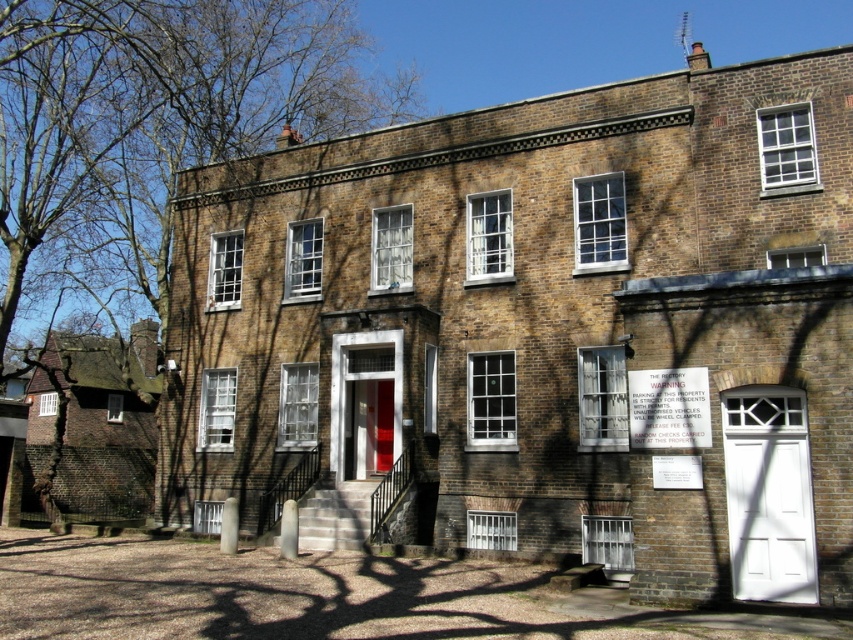
Which of these two, bare branches at left or white matte door at lower right, stands taller?

bare branches at left is taller.

Does point (347, 36) lie in front of point (801, 445)?

No, it is not.

Where is `bare branches at left`? The height and width of the screenshot is (640, 853). bare branches at left is located at coordinates (158, 125).

You are a GUI agent. You are given a task and a screenshot of the screen. Output one action in this format:
    pyautogui.click(x=<x>, y=<y>)
    Task: Click on the bare branches at left
    This screenshot has height=640, width=853.
    Given the screenshot: What is the action you would take?
    pyautogui.click(x=158, y=125)

Locate an element on the screen. bare branches at left is located at coordinates (158, 125).

Does white matte door at lower right have a larger size compared to matte red door at center?

Indeed, white matte door at lower right has a larger size compared to matte red door at center.

Is point (809, 557) positioned in front of point (364, 472)?

Yes, it is.

In order to click on white matte door at lower right in this screenshot , I will do `click(769, 513)`.